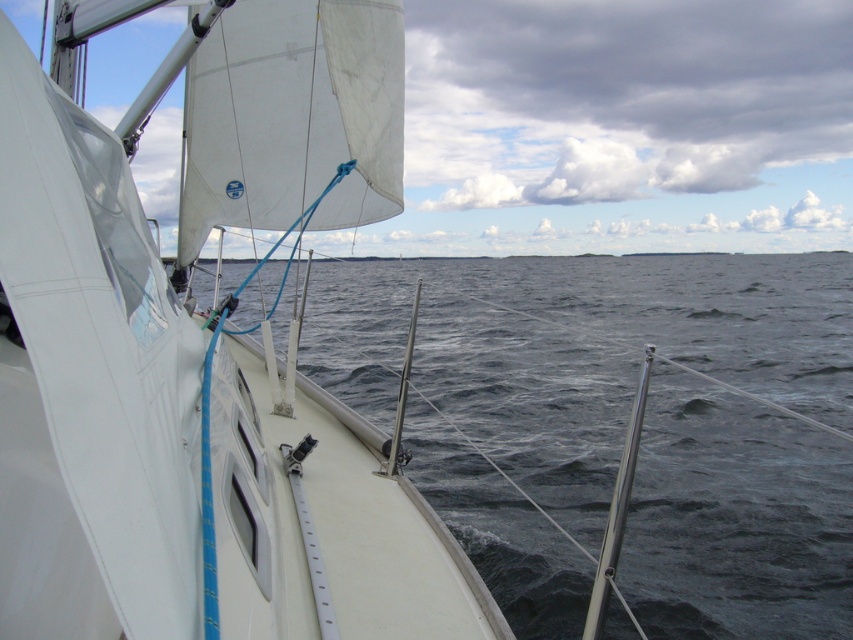
You are standing on the deck of the sailboat and see the point at coordinates point (202,356). What object is this point located on?

The point (202,356) is located on the white matte sailboat at left.

You are standing on the deck of the sailboat looking out. There are two points marked on the deck. One is at coordinate point (22, 545) and the other at point (836, 513). Which point is closer to you?

Point (22, 545) is closer to the viewer than point (836, 513).

You are a sailor on the deck of the white matte sailboat at left. You want to jump into the dark blue water at center. Is the water directly in front of the boat?

The white matte sailboat at left is in front of the dark blue water at center, so yes, the dark blue water at center is directly in front of the white matte sailboat at left. You can jump into the dark blue water at center from the boat.